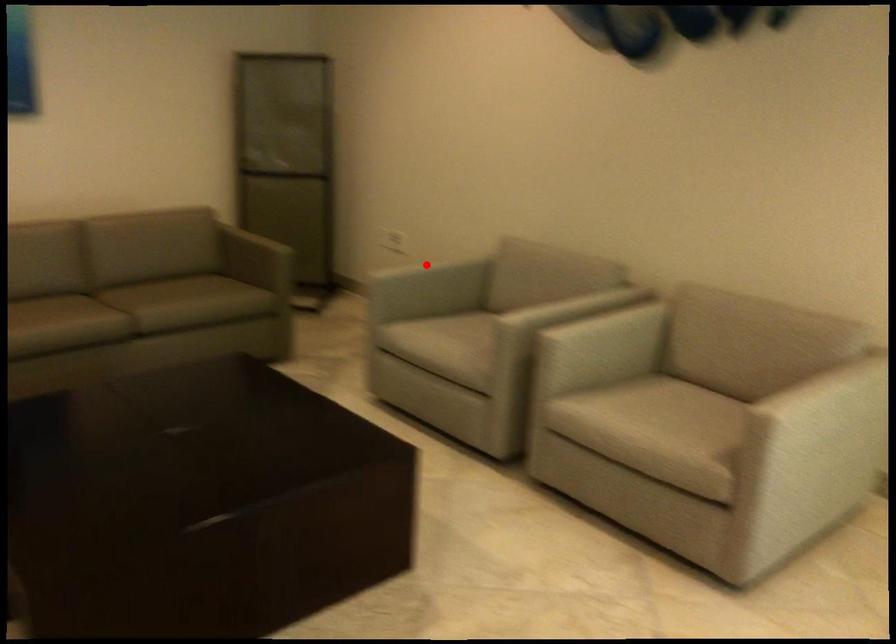
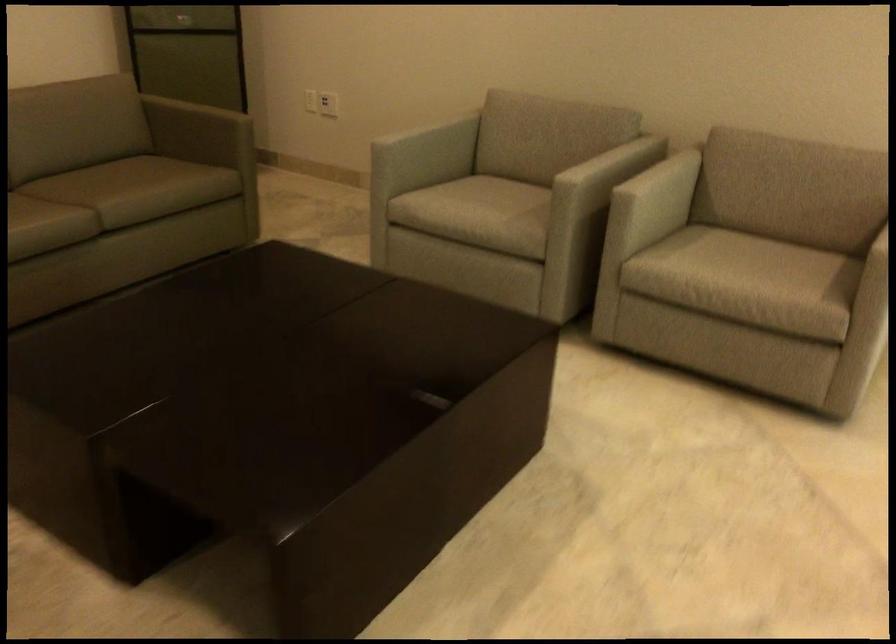
Find the pixel in the second image that matches the highlighted location in the first image.

(423, 127)